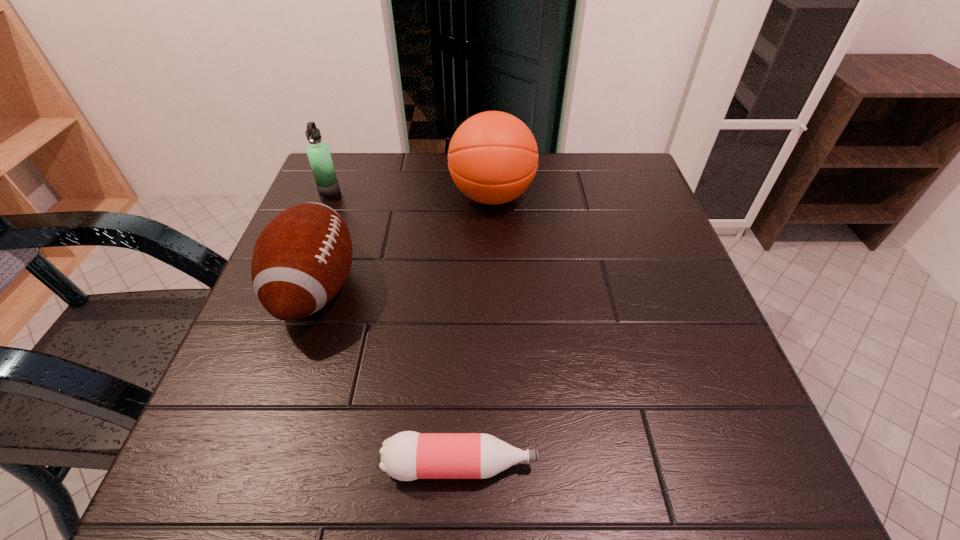
Locate an element on the screen. free space at the far right corner is located at coordinates (609, 154).

The width and height of the screenshot is (960, 540). What are the coordinates of `vacant space that is in between the basketball and the third farthest object` in the screenshot? It's located at (404, 242).

Find the location of a particular element. This screenshot has height=540, width=960. free spot between the thermos bottle and the bottle is located at coordinates (396, 329).

What are the coordinates of `unoccupied area between the football and the basketball` in the screenshot? It's located at (x=404, y=242).

Where is `vacant point located between the thermos bottle and the basketball`? vacant point located between the thermos bottle and the basketball is located at coordinates (411, 195).

Locate an element on the screen. This screenshot has width=960, height=540. free space between the shortest object and the thermos bottle is located at coordinates [396, 329].

Locate an element on the screen. vacant space that's between the basketball and the second nearest object is located at coordinates (404, 242).

Locate an element on the screen. This screenshot has height=540, width=960. vacant point located between the basketball and the shortest object is located at coordinates (476, 330).

At what (x,y) coordinates should I click in order to perform the action: click on unoccupied position between the basketball and the thermos bottle. Please return your answer as a coordinate pair (x, y). Looking at the image, I should click on (411, 195).

Select which object appears as the second closest to the shortest object. Please provide its 2D coordinates. Your answer should be formatted as a tuple, i.e. [(x, y)], where the tuple contains the x and y coordinates of a point satisfying the conditions above.

[(493, 157)]